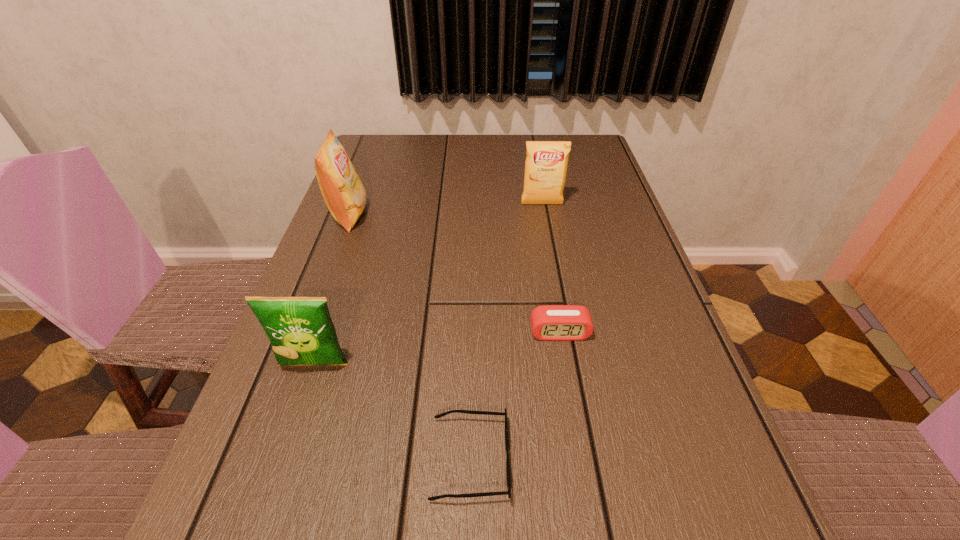
Find the location of a particular element. This screenshot has width=960, height=540. vacant area between the third nearest object and the rightmost crisp (potato chip) is located at coordinates (551, 268).

Where is `vacant point located between the rightmost crisp (potato chip) and the alarm clock`? The image size is (960, 540). vacant point located between the rightmost crisp (potato chip) and the alarm clock is located at coordinates (551, 268).

Identify which object is the fourth nearest to the third object from left to right. Please provide its 2D coordinates. Your answer should be formatted as a tuple, i.e. [(x, y)], where the tuple contains the x and y coordinates of a point satisfying the conditions above.

[(546, 164)]

I want to click on object that is the third nearest to the rightmost crisp (potato chip), so click(x=300, y=329).

Identify which crisp (potato chip) is the second closest to the rightmost crisp (potato chip). Please provide its 2D coordinates. Your answer should be formatted as a tuple, i.e. [(x, y)], where the tuple contains the x and y coordinates of a point satisfying the conditions above.

[(300, 329)]

Select which crisp (potato chip) appears as the second closest to the rightmost crisp (potato chip). Please provide its 2D coordinates. Your answer should be formatted as a tuple, i.e. [(x, y)], where the tuple contains the x and y coordinates of a point satisfying the conditions above.

[(300, 329)]

Image resolution: width=960 pixels, height=540 pixels. What are the coordinates of `free space that satisfies the following two spatial constraints: 1. on the front of the rightmost crisp (potato chip) with the logo; 2. on the front-facing side of the nearest object` in the screenshot? It's located at (588, 459).

Locate an element on the screen. free spot that satisfies the following two spatial constraints: 1. on the front of the rightmost crisp (potato chip) with the logo; 2. on the front-facing side of the nearest object is located at coordinates (588, 459).